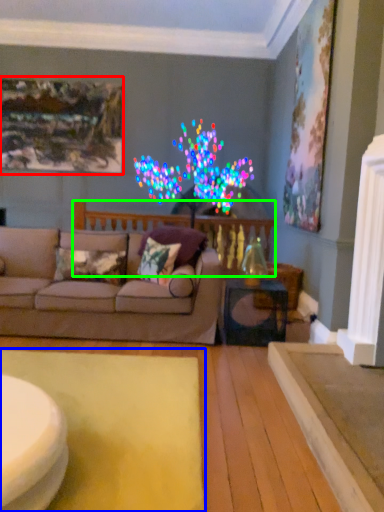
Question: Which is farther away from picture frame (highlighted by a red box)? mat (highlighted by a blue box) or balustrade (highlighted by a green box)?

Choices:
 (A) mat
 (B) balustrade

Answer: (A)